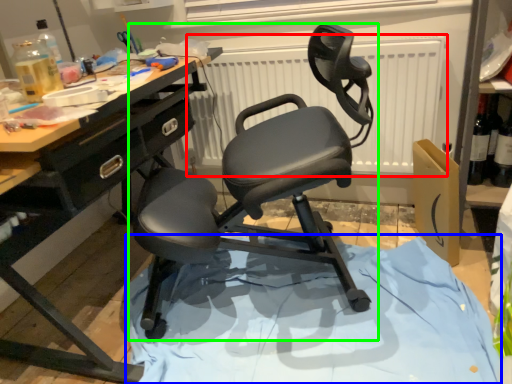
Question: Which is farther away from radiator (highlighted by a red box)? fabric (highlighted by a blue box) or chair (highlighted by a green box)?

Choices:
 (A) fabric
 (B) chair

Answer: (A)